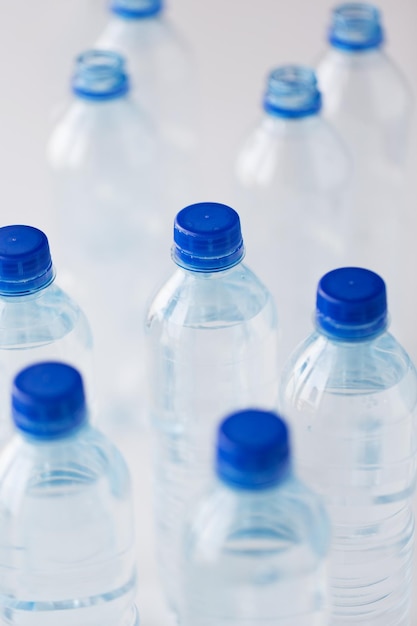
Where is `bottles (with cap)`? Image resolution: width=417 pixels, height=626 pixels. bottles (with cap) is located at coordinates (49, 293), (196, 305), (368, 346), (285, 448), (66, 423).